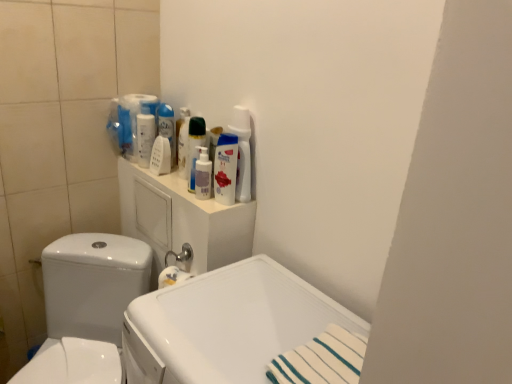
At what (x,y) coordinates should I click in order to perform the action: click on vacant region to the left of translucent plastic pump bottle at center, which appears as the 2th cleaning product when viewed from the right. Please return your answer as a coordinate pair (x, y). Image resolution: width=512 pixels, height=384 pixels. Looking at the image, I should click on (168, 184).